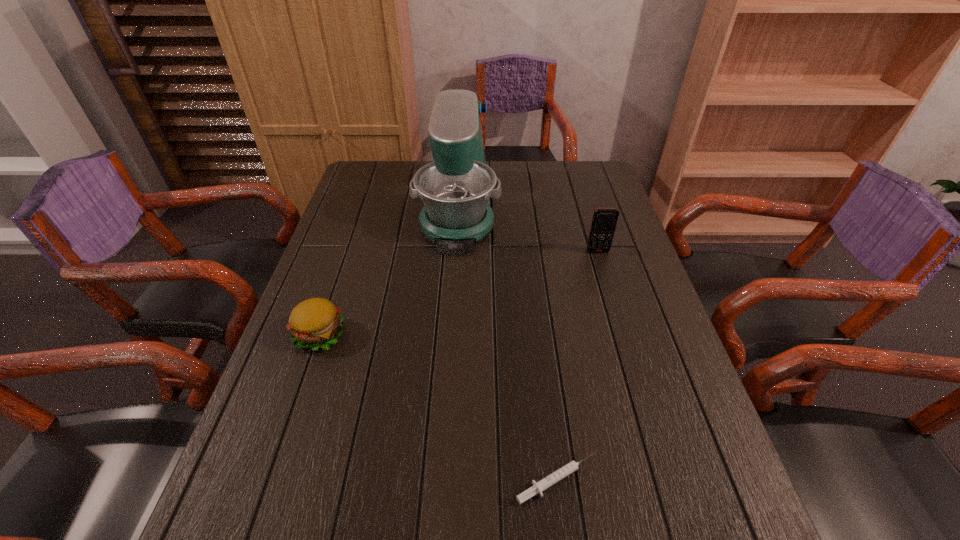
This screenshot has width=960, height=540. In order to click on vacant area that lies between the mixer and the third tallest object in this screenshot , I will do `click(389, 271)`.

This screenshot has height=540, width=960. Identify the location of free space between the leftmost object and the mixer. (389, 271).

In order to click on free spot between the cellular telephone and the second nearest object in this screenshot , I will do `click(459, 293)`.

This screenshot has height=540, width=960. I want to click on vacant space in between the tallest object and the second shortest object, so click(x=389, y=271).

Where is `empty space that is in between the second shortest object and the rightmost object`? This screenshot has width=960, height=540. empty space that is in between the second shortest object and the rightmost object is located at coordinates tap(459, 293).

Locate an element on the screen. The height and width of the screenshot is (540, 960). unoccupied area between the mixer and the hamburger is located at coordinates (389, 271).

Image resolution: width=960 pixels, height=540 pixels. Identify the location of empty space between the third farthest object and the syringe. click(x=439, y=407).

Where is `vacant area between the shortest object and the mixer`? The height and width of the screenshot is (540, 960). vacant area between the shortest object and the mixer is located at coordinates (508, 344).

Where is `the third closest object to the tallest object`? the third closest object to the tallest object is located at coordinates (537, 488).

Locate which object ranks in proximity to the tallest object. Please provide its 2D coordinates. Your answer should be formatted as a tuple, i.e. [(x, y)], where the tuple contains the x and y coordinates of a point satisfying the conditions above.

[(604, 221)]